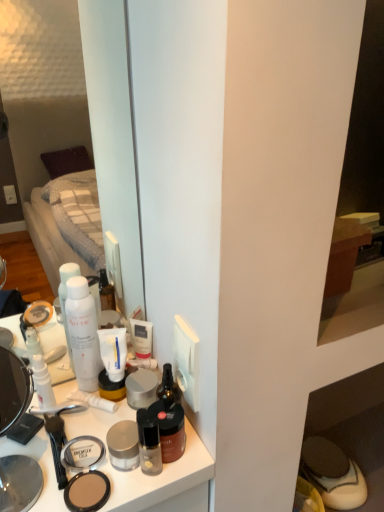
The image size is (384, 512). Find the location of `free space in front of white matte tube at center`. free space in front of white matte tube at center is located at coordinates (96, 455).